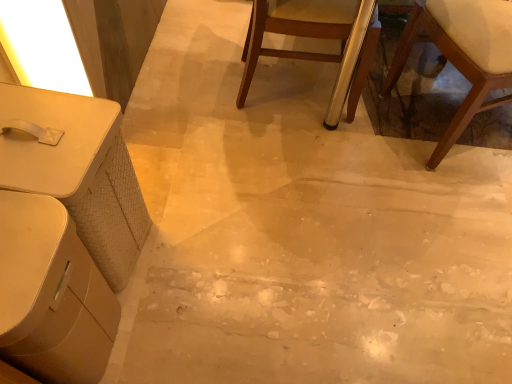
At what (x,y) coordinates should I click in order to perform the action: click on free space to the left of wooden chair at center, marked as the 1th chair in a left-to-right arrangement. Please return your answer as a coordinate pair (x, y). The height and width of the screenshot is (384, 512). Looking at the image, I should click on (183, 80).